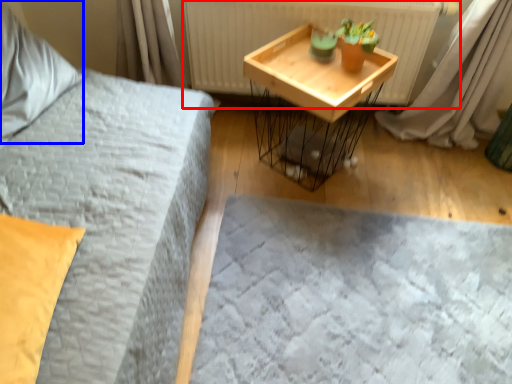
Question: Which object appears farthest to the camera in this image, radiator (highlighted by a red box) or pillow (highlighted by a blue box)?

Choices:
 (A) radiator
 (B) pillow

Answer: (A)